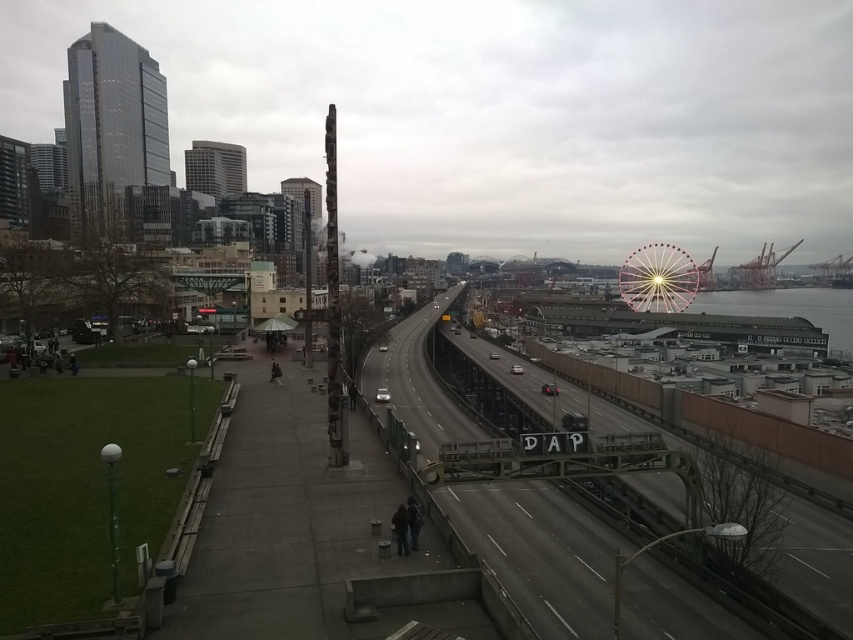
Based on the photo, you are a city planner assessing the space between the metallic gray train track at center and the pink metallic ferris wheel at upper right. Based on their widths, which one would require more horizontal space to accommodate in the city layout?

The metallic gray train track at center requires more horizontal space because its width is larger than the pink metallic ferris wheel at upper right.

You are a city planner analyzing the image. The metallic gray train track at center and the pink metallic ferris wheel at upper right are both potential sites for new public art installations. Based on their sizes, which location would allow for a larger sculpture?

The metallic gray train track at center is bigger than the pink metallic ferris wheel at upper right, so it can accommodate a larger sculpture.

You are standing on the pedestrian walkway and want to take a photo of both the metallic gray train track at center and the pink metallic ferris wheel at upper right. Which object should you position yourself closer to in order to capture both in the same frame?

You should position yourself closer to the metallic gray train track at center because it is to the left of the pink metallic ferris wheel at upper right, allowing both to be included in the frame when centered.